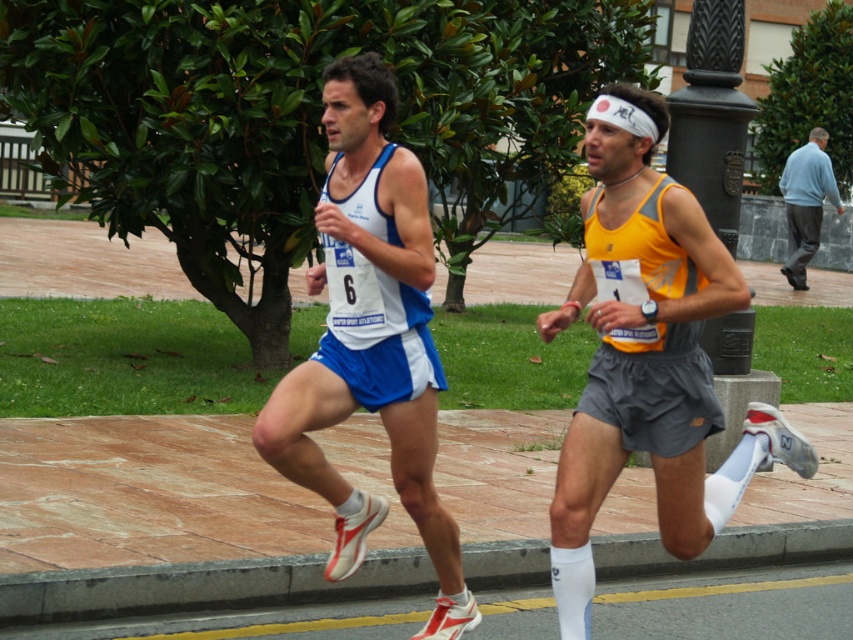
Who is higher up, gray concrete curb at lower center or light blue sweater at right?

light blue sweater at right is above.

Measure the distance between point (314, 596) and camera.

The distance of point (314, 596) from camera is 5.97 meters.

Where is `gray concrete curb at lower center`? This screenshot has width=853, height=640. gray concrete curb at lower center is located at coordinates (196, 586).